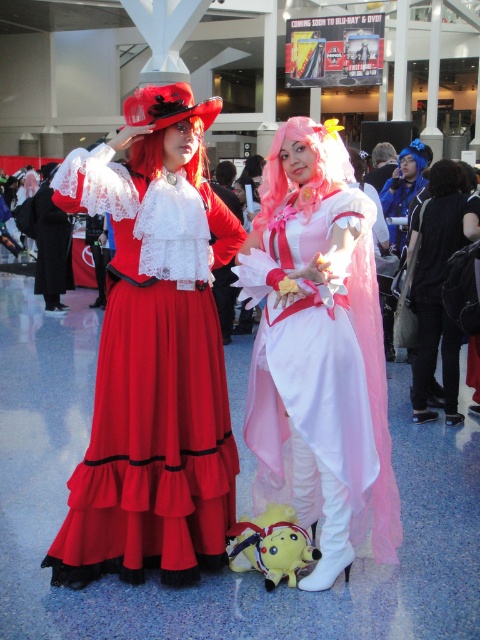
Is matte red skirt at left wider than pink silky wig at center?

Correct, the width of matte red skirt at left exceeds that of pink silky wig at center.

From the picture: Who is taller, matte red skirt at left or pink silky wig at center?

matte red skirt at left is taller.

Is point (205, 339) positioned after point (286, 179)?

That is False.

The height and width of the screenshot is (640, 480). In order to click on matte red skirt at left in this screenshot , I will do `click(152, 436)`.

Does point (325, 141) come behind point (269, 532)?

No.

Is pink silky wig at center taller than yellow plush at lower center?

Yes.

Does point (261, 196) come behind point (276, 570)?

Yes, it is behind point (276, 570).

I want to click on pink silky wig at center, so click(314, 168).

Can you confirm if matte red skirt at left is smaller than matte pink tulle dress at center?

Correct, matte red skirt at left occupies less space than matte pink tulle dress at center.

Between matte red skirt at left and matte pink tulle dress at center, which one is positioned higher?

matte red skirt at left is above.

What do you see at coordinates (152, 436) in the screenshot? The width and height of the screenshot is (480, 640). I see `matte red skirt at left` at bounding box center [152, 436].

Find the location of a particular element. The width and height of the screenshot is (480, 640). matte red skirt at left is located at coordinates tap(152, 436).